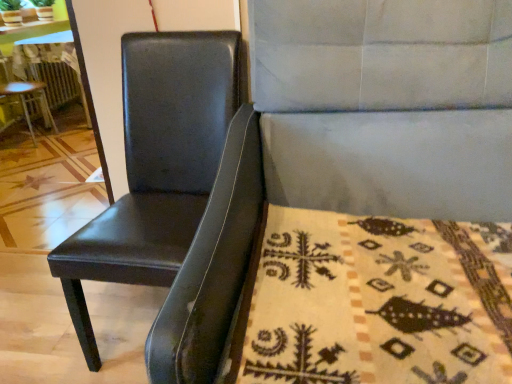
Question: Considering the relative positions of wooden table at left and beige woolen blanket at lower right in the image provided, is wooden table at left to the left of beige woolen blanket at lower right from the viewer's perspective?

Choices:
 (A) yes
 (B) no

Answer: (A)

Question: From a real-world perspective, is wooden table at left positioned under beige woolen blanket at lower right based on gravity?

Choices:
 (A) yes
 (B) no

Answer: (B)

Question: Can you confirm if wooden table at left is bigger than beige woolen blanket at lower right?

Choices:
 (A) yes
 (B) no

Answer: (A)

Question: Considering the relative sizes of wooden table at left and beige woolen blanket at lower right in the image provided, is wooden table at left smaller than beige woolen blanket at lower right?

Choices:
 (A) yes
 (B) no

Answer: (B)

Question: Does wooden table at left lie in front of beige woolen blanket at lower right?

Choices:
 (A) yes
 (B) no

Answer: (B)

Question: From their relative heights in the image, would you say black leather chair at left, acting as the third chair starting from the left, is taller or shorter than black leather chair at left, which is counted as the 3th chair, starting from the right?

Choices:
 (A) short
 (B) tall

Answer: (B)

Question: In terms of width, does black leather chair at left, acting as the third chair starting from the left, look wider or thinner when compared to black leather chair at left, the 1th chair positioned from the left?

Choices:
 (A) wide
 (B) thin

Answer: (A)

Question: Considering their positions, is black leather chair at left, acting as the third chair starting from the left, located in front of or behind black leather chair at left, which is counted as the 3th chair, starting from the right?

Choices:
 (A) behind
 (B) front

Answer: (B)

Question: Do you think black leather chair at left, the 3th chair from the back, is within black leather chair at left, which is counted as the 3th chair, starting from the right, or outside of it?

Choices:
 (A) inside
 (B) outside

Answer: (B)

Question: Relative to wooden table at left, is black leather chair at left, which is the 3th chair from front to back, in front or behind?

Choices:
 (A) front
 (B) behind

Answer: (A)

Question: From the image's perspective, is black leather chair at left, the 1th chair positioned from the left, located above or below wooden table at left?

Choices:
 (A) above
 (B) below

Answer: (B)

Question: Considering the positions of point (34, 99) and point (64, 81), is point (34, 99) closer or farther from the camera than point (64, 81)?

Choices:
 (A) closer
 (B) farther

Answer: (A)

Question: Which is correct: black leather chair at left, the 1th chair positioned from the left, is inside wooden table at left, or outside of it?

Choices:
 (A) inside
 (B) outside

Answer: (B)

Question: Is beige woolen blanket at lower right taller or shorter than black leather chair at left, which is the 3th chair from front to back?

Choices:
 (A) short
 (B) tall

Answer: (A)

Question: Do you think beige woolen blanket at lower right is within black leather chair at left, the 1th chair positioned from the left, or outside of it?

Choices:
 (A) outside
 (B) inside

Answer: (A)